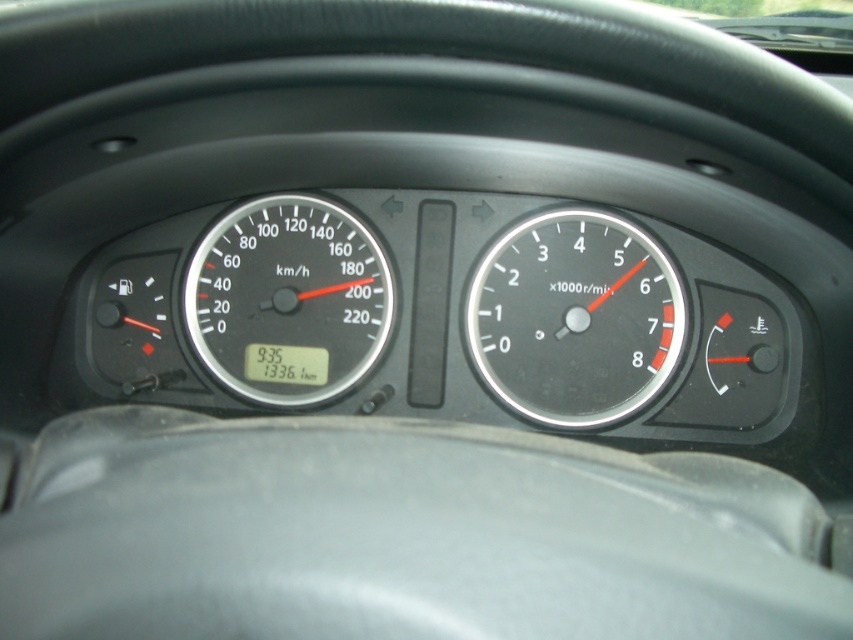
Question: Which point is closer to the camera?

Choices:
 (A) metallic silver speedometer at center
 (B) black plastic speedometer at center

Answer: (A)

Question: Which point is closer to the camera?

Choices:
 (A) (247, 372)
 (B) (676, 326)

Answer: (B)

Question: Can you confirm if metallic silver speedometer at center is smaller than black plastic speedometer at center?

Choices:
 (A) yes
 (B) no

Answer: (A)

Question: Observing the image, what is the correct spatial positioning of metallic silver speedometer at center in reference to black plastic speedometer at center?

Choices:
 (A) above
 (B) below

Answer: (B)

Question: Which object appears farthest from the camera in this image?

Choices:
 (A) metallic silver speedometer at center
 (B) black plastic speedometer at center

Answer: (B)

Question: Is metallic silver speedometer at center bigger than black plastic speedometer at center?

Choices:
 (A) no
 (B) yes

Answer: (A)